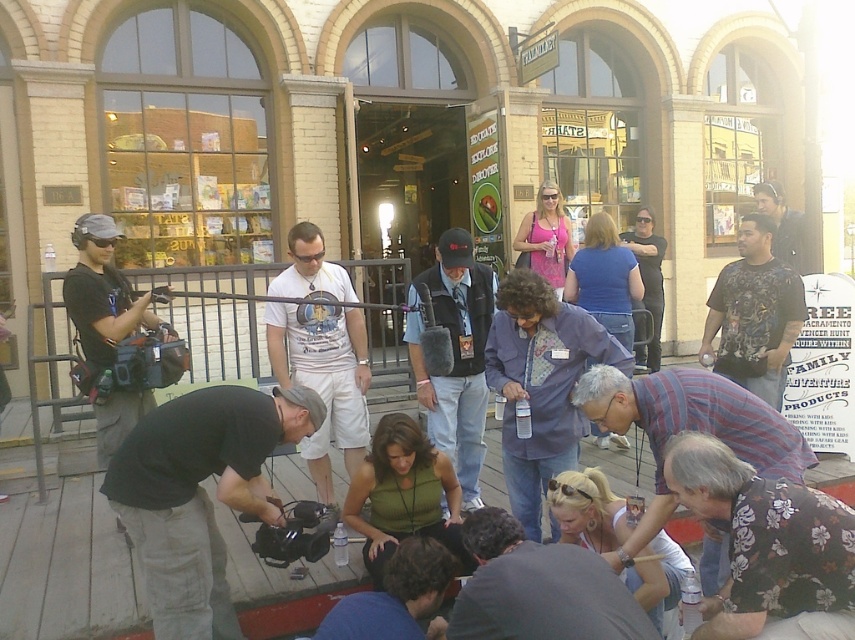
Question: Does dark gray shirt at lower center lie in front of striped cotton shirt at lower right?

Choices:
 (A) yes
 (B) no

Answer: (A)

Question: Does matte black camera at left have a larger size compared to dark brown leather jacket at lower center?

Choices:
 (A) yes
 (B) no

Answer: (A)

Question: Can you confirm if white cotton t-shirt at center is smaller than denim vest at center?

Choices:
 (A) yes
 (B) no

Answer: (B)

Question: Which is nearer to the matte black camera at left?

Choices:
 (A) black plastic video camera at center
 (B) white cotton t-shirt at center
 (C) denim vest at center

Answer: (B)

Question: Which object is positioned closest to the matte black camera at left?

Choices:
 (A) dark brown leather jacket at lower center
 (B) dark blue shirt at center
 (C) black plastic video camera at center

Answer: (C)

Question: Considering the real-world distances, which object is closest to the metal fence at left?

Choices:
 (A) denim vest at center
 (B) matte black shirt at center

Answer: (A)